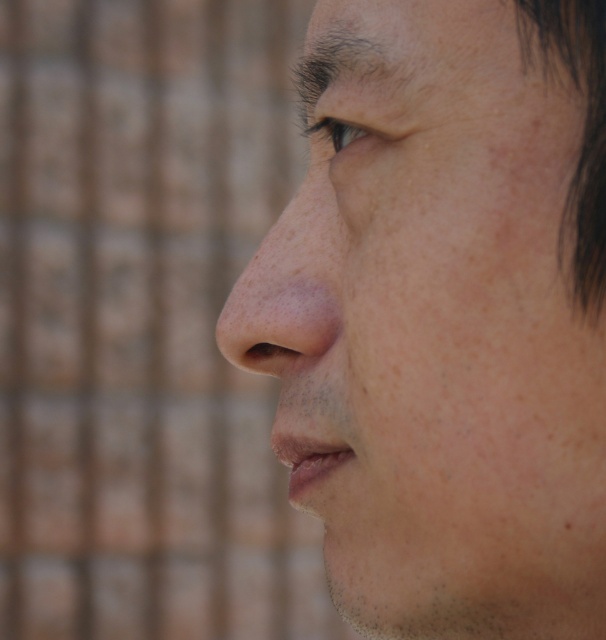
Question: Does dry skin nose at center have a lesser width compared to dark brown eye at upper center?

Choices:
 (A) yes
 (B) no

Answer: (B)

Question: Considering the relative positions of smooth skin face at center and dry skin nose at center in the image provided, where is smooth skin face at center located with respect to dry skin nose at center?

Choices:
 (A) below
 (B) above

Answer: (A)

Question: Which of these objects is positioned closest to the smooth skin face at center?

Choices:
 (A) dark brown eye at upper center
 (B) dry skin nose at center

Answer: (B)

Question: Which of the following is the farthest from the observer?

Choices:
 (A) (370, 465)
 (B) (319, 120)
 (C) (270, 269)

Answer: (C)

Question: Does smooth skin face at center come in front of dark brown eye at upper center?

Choices:
 (A) yes
 (B) no

Answer: (A)

Question: Among these objects, which one is farthest from the camera?

Choices:
 (A) dark brown eye at upper center
 (B) smooth skin face at center

Answer: (A)